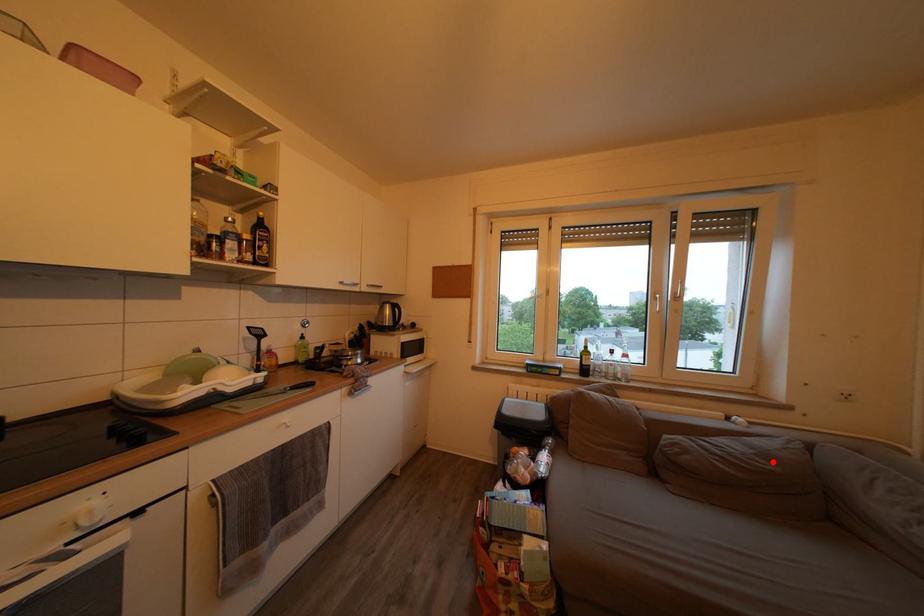
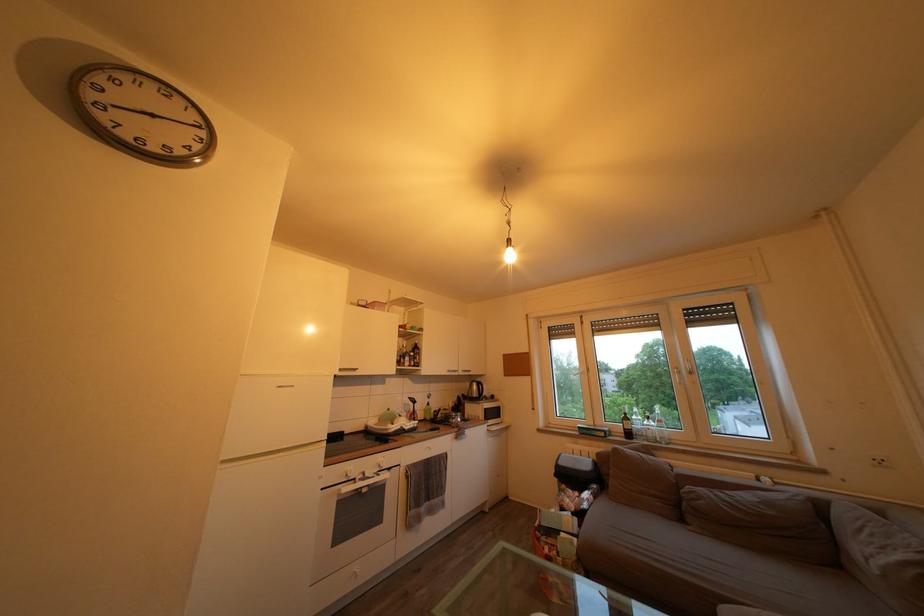
In the second image, find the point that corresponds to the highlighted location in the first image.

(774, 509)